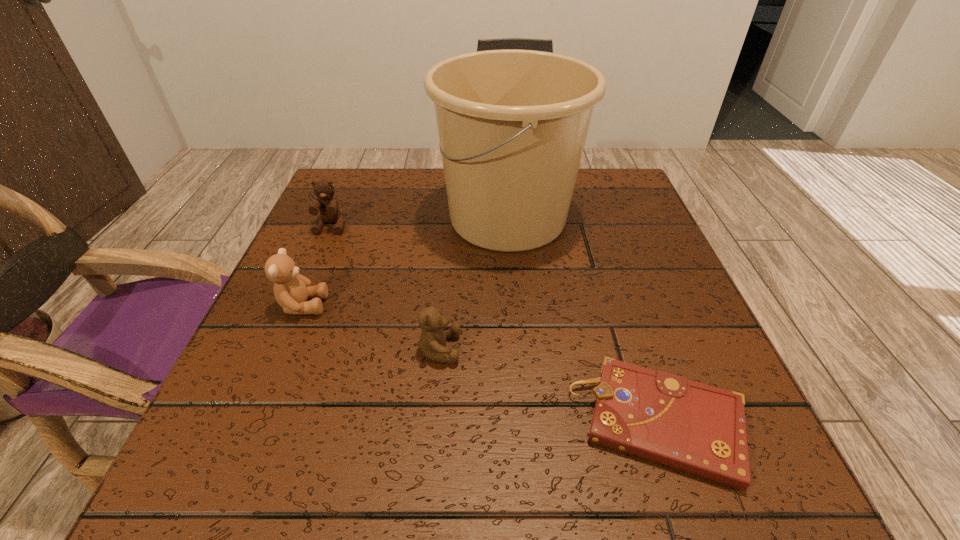
This screenshot has height=540, width=960. I want to click on vacant position at the left edge of the desktop, so click(x=306, y=250).

At what (x,y) coordinates should I click in order to perform the action: click on vacant space at the right edge of the desktop. Please return your answer as a coordinate pair (x, y). Image resolution: width=960 pixels, height=540 pixels. Looking at the image, I should click on (669, 277).

Image resolution: width=960 pixels, height=540 pixels. What are the coordinates of `free spot at the far left corner of the desktop` in the screenshot? It's located at (335, 171).

The height and width of the screenshot is (540, 960). What are the coordinates of `free space at the near left corner of the desktop` in the screenshot? It's located at [254, 488].

Locate an element on the screen. The image size is (960, 540). vacant space at the far right corner of the desktop is located at coordinates (600, 169).

Identify the location of free spot between the rightmost teddy bear and the bucket. The width and height of the screenshot is (960, 540). (473, 284).

Locate an element on the screen. The width and height of the screenshot is (960, 540). free space between the bucket and the notebook is located at coordinates 584,320.

At what (x,y) coordinates should I click in order to perform the action: click on blank region between the tallest object and the notebook. Please return your answer as a coordinate pair (x, y). The height and width of the screenshot is (540, 960). Looking at the image, I should click on (584, 320).

Find the location of a particular element. The height and width of the screenshot is (540, 960). free spot between the bucket and the third farthest object is located at coordinates (405, 262).

Find the location of a particular element. Image resolution: width=960 pixels, height=540 pixels. empty location between the farthest teddy bear and the notebook is located at coordinates (495, 325).